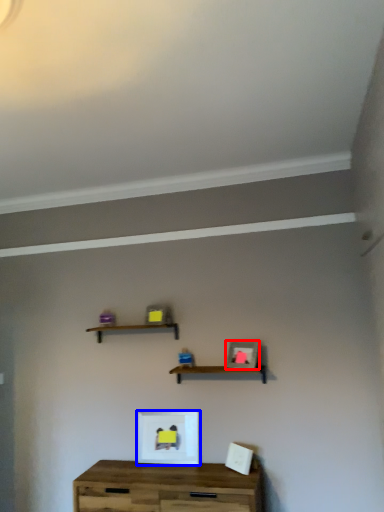
Question: Among these objects, which one is nearest to the camera, picture frame (highlighted by a red box) or picture frame (highlighted by a blue box)?

Choices:
 (A) picture frame
 (B) picture frame

Answer: (A)